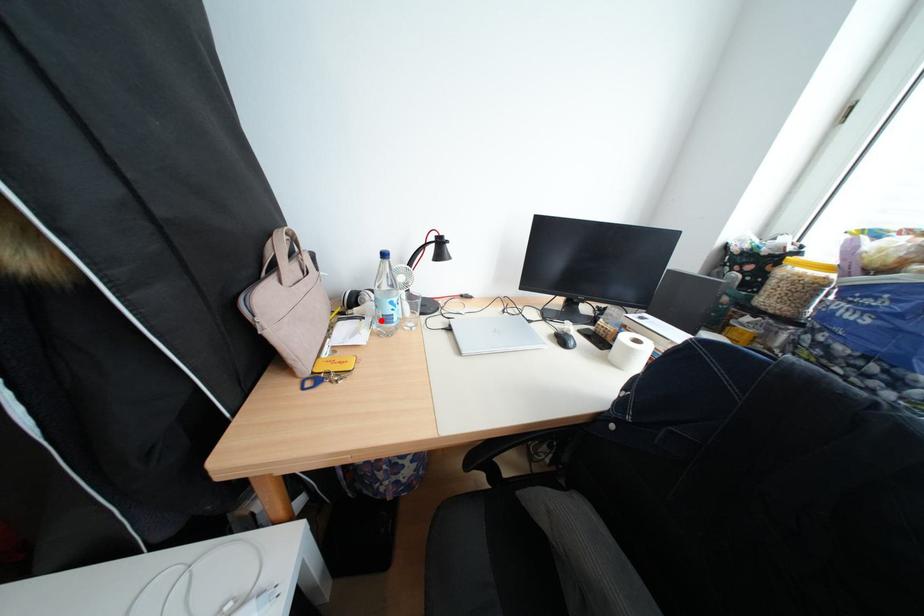
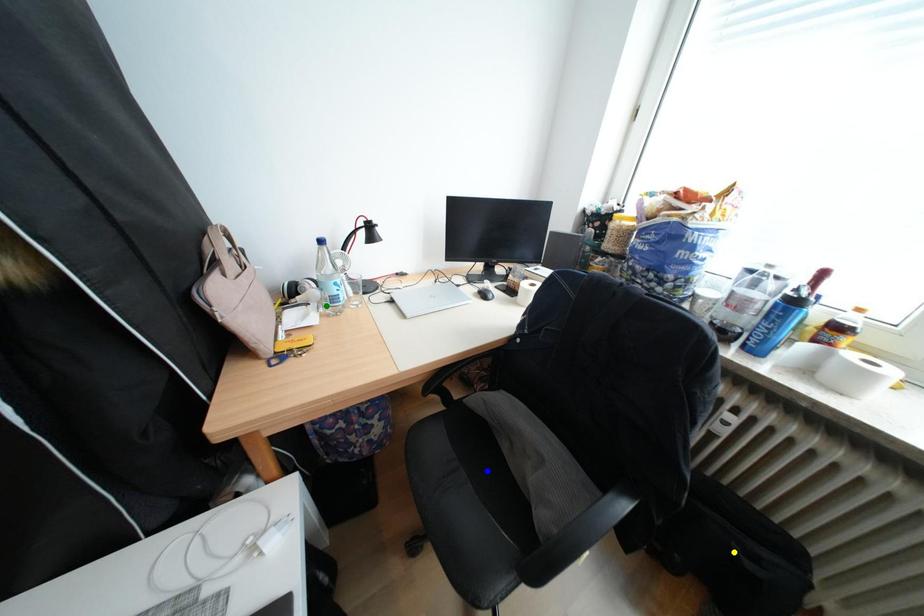
Question: I am providing you with two images of the same scene from different viewpoints. A red point is marked on the first image. You are given multiple points on the second image. Which point in image 2 represents the same 3d spot as the red point in image 1?

Choices:
 (A) yellow point
 (B) green point
 (C) blue point

Answer: (B)